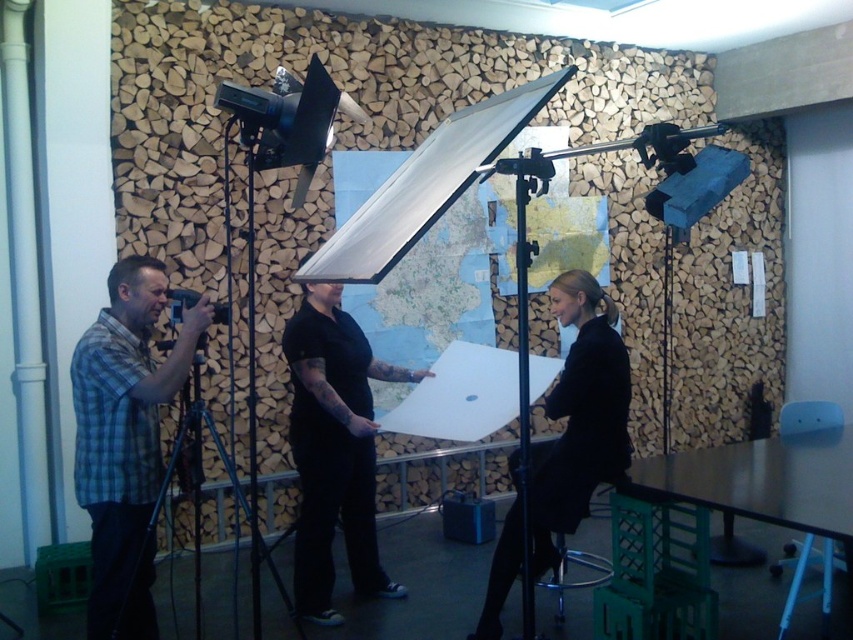
You are standing in the photography setup and want to place a small light between the two points, point (310, 445) and point (199, 548). Which point is closer to you so that the light can be placed in front of it?

Point (310, 445) is closer to you than point (199, 548), so you should place the light in front of point (310, 445) to ensure it is closer to the viewer.

Where is the black matte shirt at center located in the image?

The black matte shirt at center is located at point coordinates of 0.703 on the x axis and 0.393 on the y axis.

Looking at this image, you are part of the photography team and need to position a reflector to the right of both the plaid shirt at left and the black matte dress at center. Is this possible given their current positions?

The plaid shirt at left is to the left of the black matte dress at center, so placing a reflector to the right of both would be possible as their relative positions allow space on their combined right side.